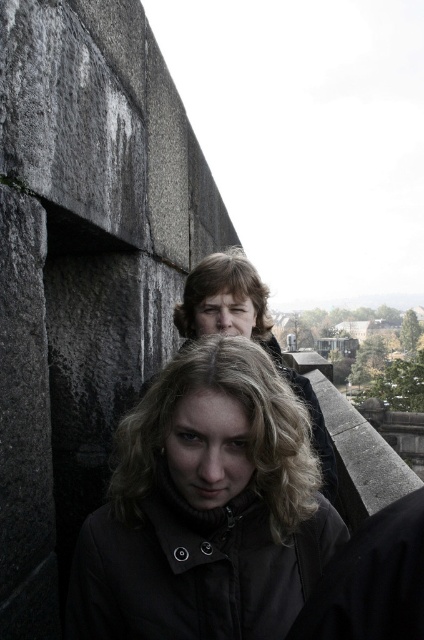
You are a photographer trying to capture a portrait of the two people standing against the stone wall. You want to ensure that the matte black jacket at upper center and the blonde curly hair at upper center are both clearly visible in the frame. Based on their positions, which object should you focus on first to ensure both are in focus?

The matte black jacket at upper center is below the blonde curly hair at upper center, so focusing on the blonde curly hair at upper center first would ensure both are in focus since it is higher up and the jacket is positioned lower.

You are a photographer trying to capture a portrait of the two people standing against the stone wall. To ensure both the matte black jacket at center and the blonde curly hair at upper center are clearly visible in the frame, which object should you focus on first?

The matte black jacket at center is located below the blonde curly hair at upper center. Since the jacket is lower, you should focus on the blonde curly hair at upper center first to ensure both are in focus as they are stacked vertically.

You are standing at point (261, 291) and want to move to the entrance located at point (231, 515). Given the stone wall in the scene, is the path from your current position to the entrance clear of any obstacles?

Point (231, 515) is in front of point (261, 291), so the path from your current position to the entrance is clear of obstacles.